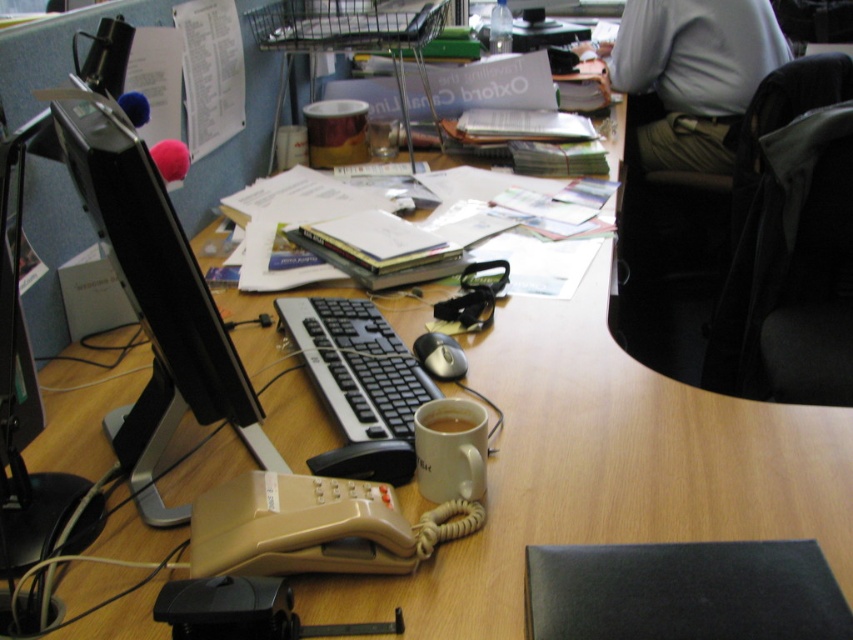
You are organizing the desk and want to place a new item between the black glossy monitor at left and the matte ceramic mug at center. Since the monitor is in front of the mug, where should you place the new item to ensure it is between them?

The new item should be placed behind the black glossy monitor at left and in front of the matte ceramic mug at center to be between them.

You are organizing the desk items and need to place the gray fabric shirt at upper right and the matte ceramic mug at center into a drawer. The drawer has a height limit of 10 cm. Which item might not fit if placed vertically?

The gray fabric shirt at upper right has a greater height compared to the matte ceramic mug at center. Since the drawer has a height limit of 10 cm, the gray fabric shirt at upper right might not fit vertically if its height exceeds 10 cm.

You are an office worker who needs to hang a small picture frame that is 0.1 meters wide on the desk wall. The frame must be placed exactly at the coordinates given for the gray fabric shirt at upper right. Can you confirm if there is enough space at that location to hang the frame without overlapping any items on the desk?

The gray fabric shirt at upper right is located at coordinates point (693,74). Since the frame is 0.1 meters wide and the coordinates specify an exact point, there should be enough space as long as no items are placed precisely at that spot. However, since the desk is cluttered, it is advisable to check the area physically before hanging.